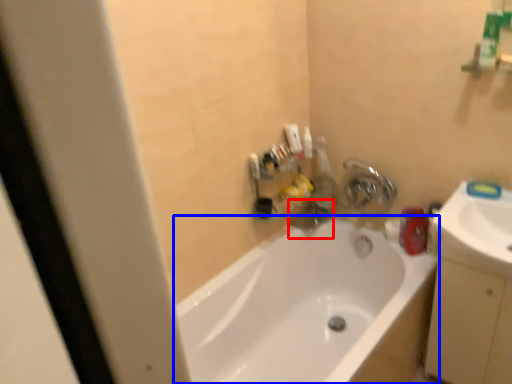
Question: Which of the following is the farthest to the observer, plumbing fixture (highlighted by a red box) or bathtub (highlighted by a blue box)?

Choices:
 (A) plumbing fixture
 (B) bathtub

Answer: (A)